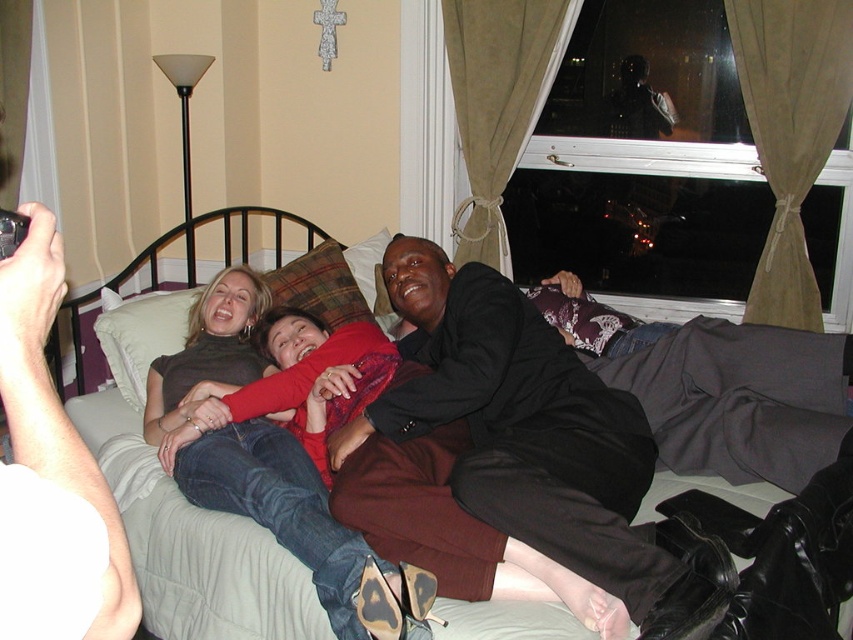
Question: Which object appears farthest from the camera in this image?

Choices:
 (A) denim jeans at center
 (B) light gray fabric bed at center
 (C) dark brown leather jacket at center
 (D) plaid fabric pillow at center

Answer: (D)

Question: In this image, where is light gray fabric bed at center located relative to dark brown leather jacket at center?

Choices:
 (A) below
 (B) above

Answer: (A)

Question: Estimate the real-world distances between objects in this image. Which object is farther from the plaid fabric pillow at center?

Choices:
 (A) light gray fabric bed at center
 (B) dark brown leather jacket at center
 (C) denim jeans at center

Answer: (B)

Question: From the image, what is the correct spatial relationship of light gray fabric bed at center in relation to denim jeans at center?

Choices:
 (A) left
 (B) right

Answer: (A)

Question: Which of these objects is positioned closest to the dark brown leather jacket at center?

Choices:
 (A) light gray fabric bed at center
 (B) denim jeans at center

Answer: (B)

Question: Is dark brown leather jacket at center below plaid fabric pillow at center?

Choices:
 (A) no
 (B) yes

Answer: (B)